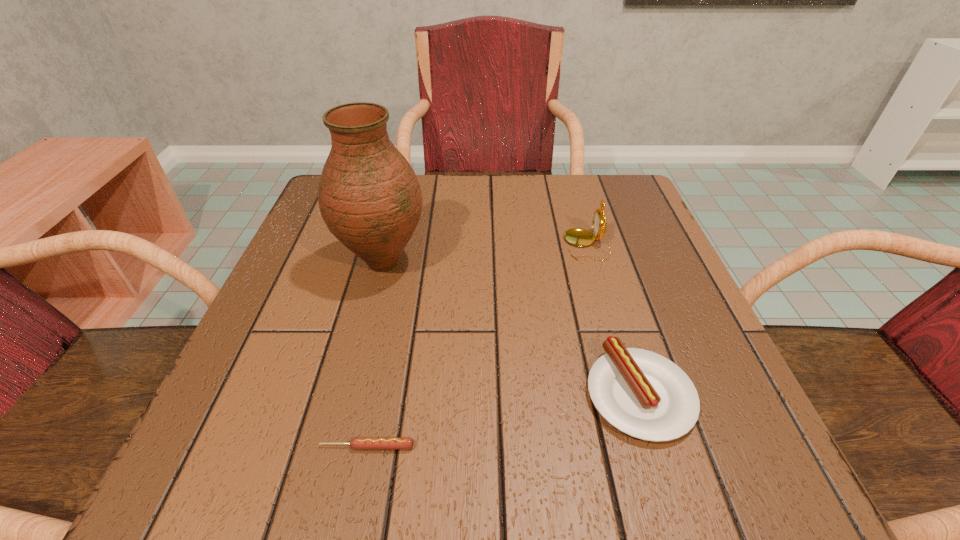
I want to click on vacant region at the left edge of the desktop, so click(293, 321).

Where is `free location at the right edge of the desktop`? The width and height of the screenshot is (960, 540). free location at the right edge of the desktop is located at coordinates (625, 243).

Where is `vacant space at the far right corner`? vacant space at the far right corner is located at coordinates (604, 190).

Find the location of a particular element. This screenshot has width=960, height=540. free space between the tallest object and the left sausage is located at coordinates (375, 355).

Find the location of `unoccupied position between the shortest object and the tallest object`. unoccupied position between the shortest object and the tallest object is located at coordinates tap(375, 355).

Image resolution: width=960 pixels, height=540 pixels. Identify the location of vacant space in between the left sausage and the right sausage. (503, 420).

Where is `free space between the vase and the shorter sausage`? The image size is (960, 540). free space between the vase and the shorter sausage is located at coordinates (375, 355).

The width and height of the screenshot is (960, 540). Identify the location of unoccupied position between the vase and the left sausage. (375, 355).

What are the coordinates of `empty location between the third tallest object and the vase` in the screenshot? It's located at (512, 328).

Locate an element on the screen. The width and height of the screenshot is (960, 540). unoccupied position between the second tallest object and the right sausage is located at coordinates (612, 319).